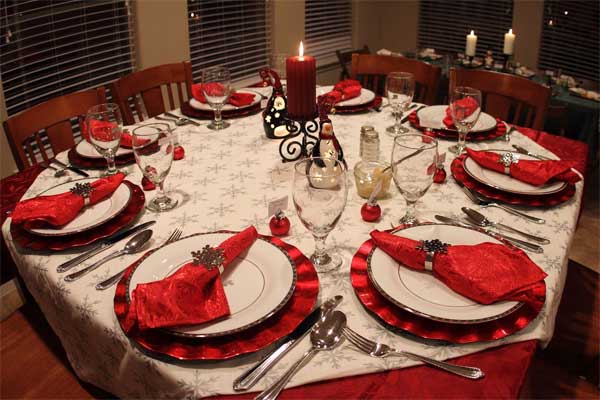
Identify the location of windows. (94, 23), (213, 44), (313, 19), (445, 19), (555, 19).